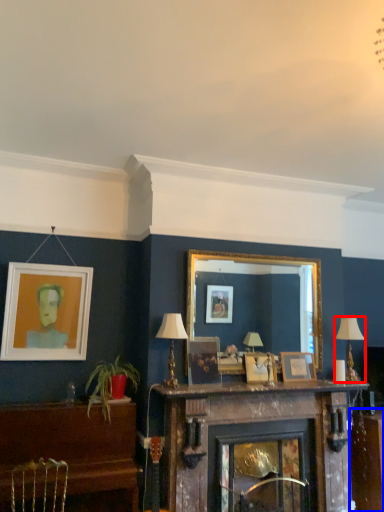
Question: Which object is further to the camera taking this photo, lamp (highlighted by a red box) or table (highlighted by a blue box)?

Choices:
 (A) lamp
 (B) table

Answer: (B)